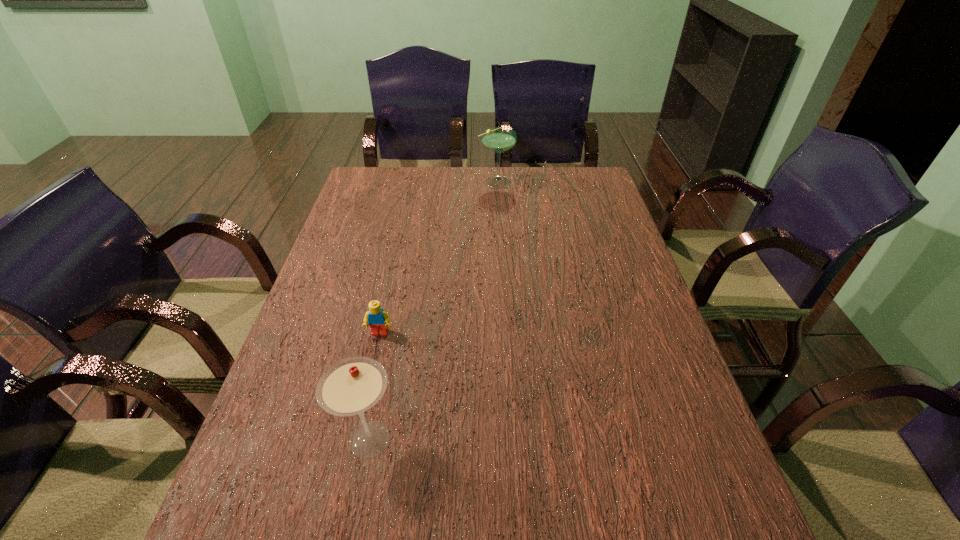
Where is `the rightmost object`? This screenshot has height=540, width=960. the rightmost object is located at coordinates (497, 139).

Find the location of a particular element. the farthest object is located at coordinates (497, 139).

I want to click on the left martini, so click(351, 386).

Find the location of a particular element. This screenshot has height=540, width=960. the nearest object is located at coordinates (351, 386).

Where is `Lego`? Lego is located at coordinates (378, 320).

This screenshot has width=960, height=540. Find the location of `the second nearest object`. the second nearest object is located at coordinates (378, 320).

This screenshot has height=540, width=960. Identify the location of vacant space situated 0.080m on the left of the farther martini. (457, 181).

Locate an element on the screen. blank area located 0.160m on the left of the nearer martini is located at coordinates (258, 439).

Identify the location of vacant space located 0.050m on the front-facing side of the shortest object. (375, 356).

This screenshot has width=960, height=540. I want to click on object located at the far edge, so click(497, 139).